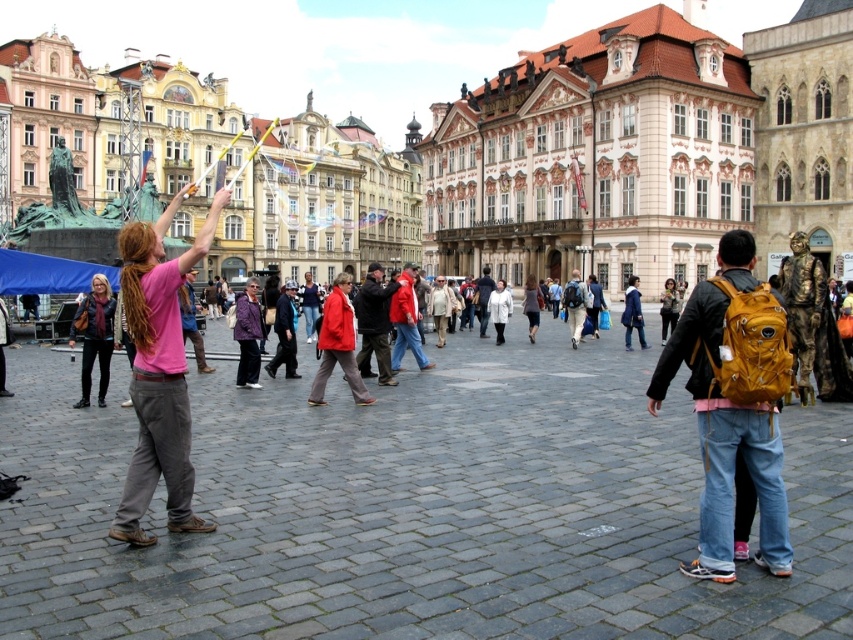
Question: Which point is farther to the camera?

Choices:
 (A) (711, 308)
 (B) (134, 529)

Answer: (A)

Question: Considering the real-world distances, which object is farthest from the matte yellow backpack at right?

Choices:
 (A) leather jacket at center
 (B) matte red coat at center
 (C) pink fabric shirt at left

Answer: (A)

Question: Does pink fabric shirt at left have a greater width compared to matte red coat at center?

Choices:
 (A) yes
 (B) no

Answer: (A)

Question: Does matte yellow backpack at right have a greater width compared to matte red coat at center?

Choices:
 (A) yes
 (B) no

Answer: (A)

Question: Which of the following is the farthest from the observer?

Choices:
 (A) matte red coat at center
 (B) matte yellow backpack at right
 (C) leather jacket at center

Answer: (A)

Question: Where is matte red coat at center located in relation to leather jacket at center in the image?

Choices:
 (A) right
 (B) left

Answer: (A)